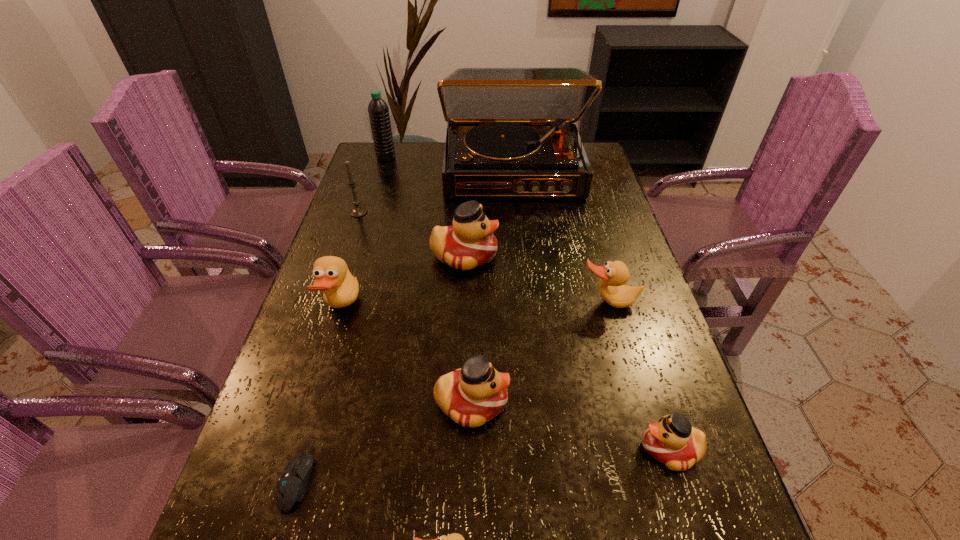
The height and width of the screenshot is (540, 960). Find the location of `record player that is at the right edge`. record player that is at the right edge is located at coordinates (511, 133).

You are a GUI agent. You are given a task and a screenshot of the screen. Output one action in this format:
    pyautogui.click(x=<x>, y=<y>)
    Task: Click on the object positioned at the far left corner
    
    Given the screenshot: What is the action you would take?
    pyautogui.click(x=378, y=110)

The width and height of the screenshot is (960, 540). What are the coordinates of `object located at the far right corner` in the screenshot? It's located at (511, 133).

Locate an element on the screen. This screenshot has height=540, width=960. vacant space at the far edge of the desktop is located at coordinates (413, 151).

Find the location of a particular element. Image resolution: width=960 pixels, height=540 pixels. vacant position at the left edge of the desktop is located at coordinates (269, 401).

The height and width of the screenshot is (540, 960). In order to click on free spot at the right edge of the desktop in this screenshot , I will do `click(679, 378)`.

I want to click on vacant space at the far right corner of the desktop, so click(591, 143).

Locate an element on the screen. The image size is (960, 540). unoccupied position between the record player and the computer mouse is located at coordinates (405, 325).

Locate an element on the screen. This screenshot has width=960, height=540. free spot between the second smallest red duck and the leftmost tan duck is located at coordinates (406, 355).

At what (x,y) coordinates should I click in order to perform the action: click on empty location between the rightmost red duck and the gray candle. Please return your answer as a coordinate pair (x, y). Looking at the image, I should click on (514, 330).